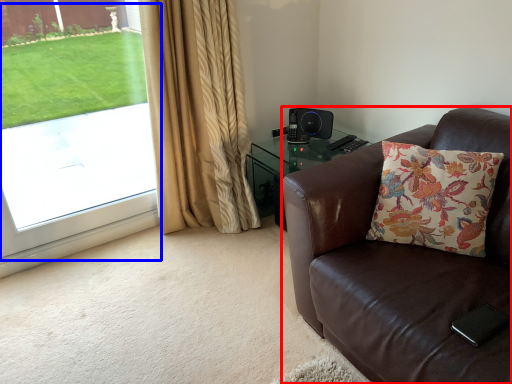
Question: Which point is further to the camera, chair (highlighted by a red box) or window screen (highlighted by a blue box)?

Choices:
 (A) chair
 (B) window screen

Answer: (B)